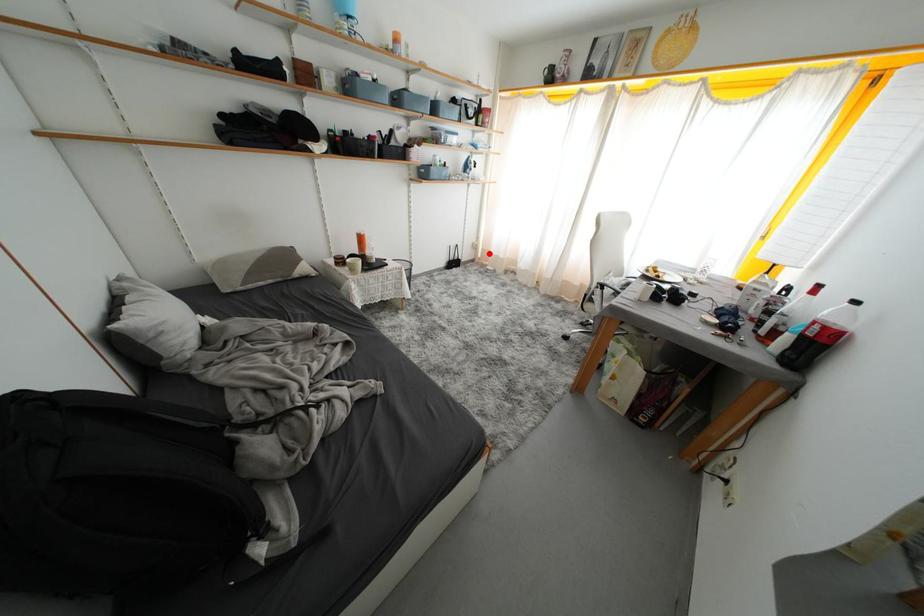
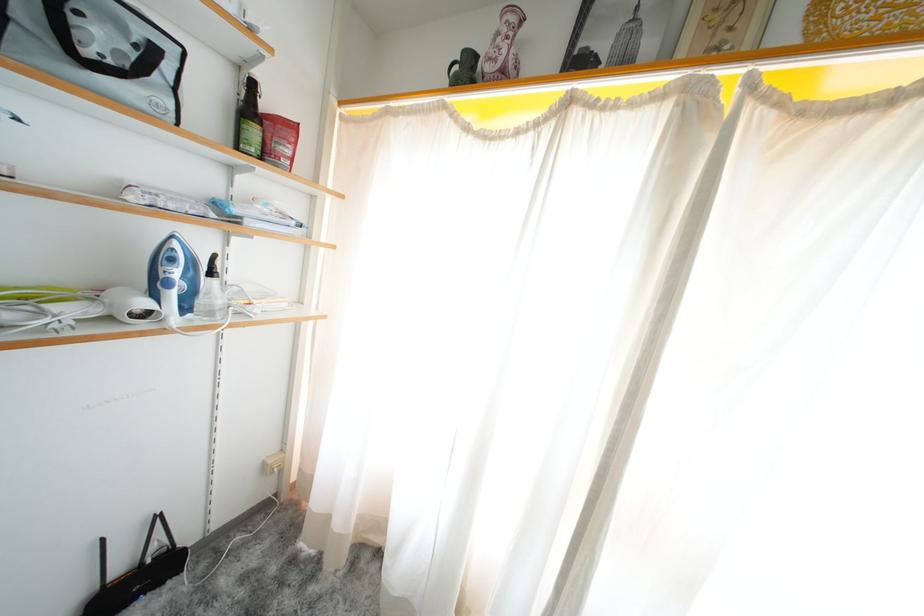
Find the pixel in the second image that matches the highlighted location in the first image.

(306, 475)